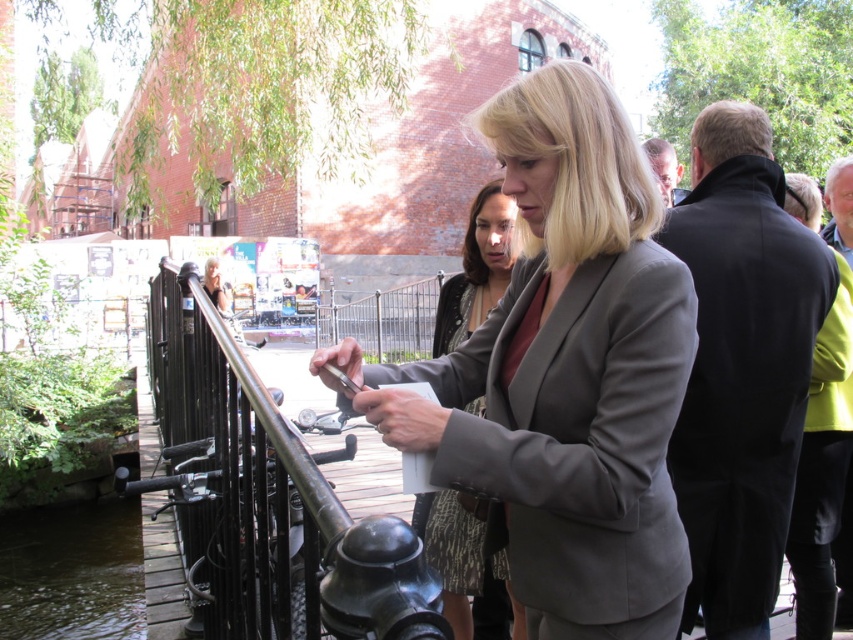
You are a tailor measuring the distance between two important items for a costume design. The items are the matte gray blazer at center and the red top. How far apart are they?

The matte gray blazer at center and the red top are 1.19 meters apart.

You are standing at the point marked as point (547,557) and want to reach the wooden bridge over the canal. The maximum distance you can walk is 1.30 meters. Can you reach the bridge?

The distance between you and the wooden bridge over the canal is 1.40 meters, which exceeds your maximum walking distance of 1.30 meters. Therefore, you cannot reach the bridge.

What are the coordinates of the matte gray blazer at center?

The matte gray blazer at center is located at point (564, 372).